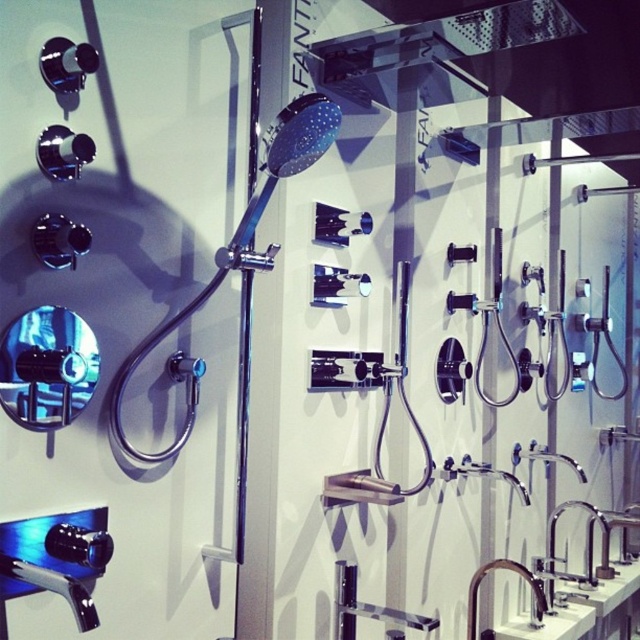
Who is taller, white glossy sink at lower right or polished chrome faucet at lower right?

With more height is polished chrome faucet at lower right.

Does point (531, 636) come farther from viewer compared to point (467, 609)?

Yes, point (531, 636) is behind point (467, 609).

The height and width of the screenshot is (640, 640). I want to click on white glossy sink at lower right, so click(550, 625).

Who is shorter, chrome/metallic faucet at center-right or satin nickel faucet at lower right?

satin nickel faucet at lower right

Identify the location of chrome/metallic faucet at center-right. click(x=589, y=552).

Is point (308, 96) in front of point (605, 518)?

Yes, point (308, 96) is closer to viewer.

Who is taller, chrome/metallic shower head at center-left or satin nickel faucet at lower right?

With more height is chrome/metallic shower head at center-left.

Does point (140, 355) come behind point (595, 568)?

No, it is not.

I want to click on chrome/metallic shower head at center-left, so click(x=243, y=228).